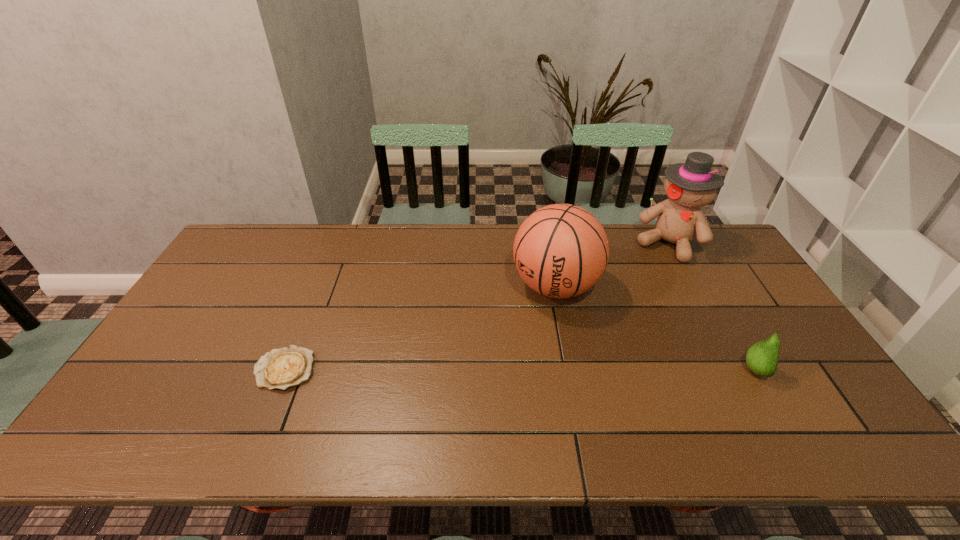
Image resolution: width=960 pixels, height=540 pixels. Find the location of `free space on the desktop that is between the quiche and the second shortest object and is positioned on the surface of the third object from right to left near the brand logo`. free space on the desktop that is between the quiche and the second shortest object and is positioned on the surface of the third object from right to left near the brand logo is located at coordinates (496, 370).

I want to click on free space on the desktop that is between the shortest object and the avocado and is positioned on the front-facing side of the rag_doll, so click(x=585, y=370).